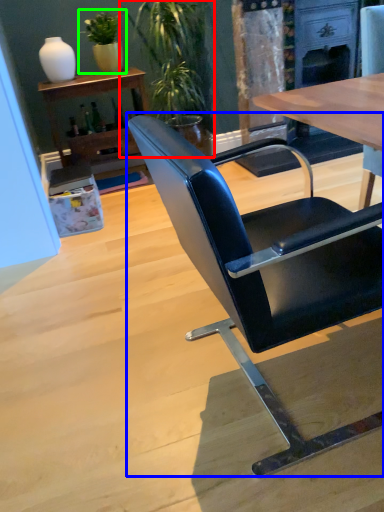
Question: Based on their relative distances, which object is nearer to houseplant (highlighted by a red box)? Choose from chair (highlighted by a blue box) and houseplant (highlighted by a green box).

Choices:
 (A) chair
 (B) houseplant

Answer: (B)